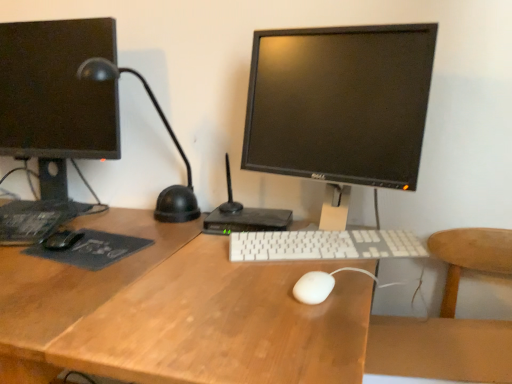
Identify the location of free space in front of black matte mouse at left, which is the 1th mouse in left-to-right order. This screenshot has width=512, height=384. (44, 271).